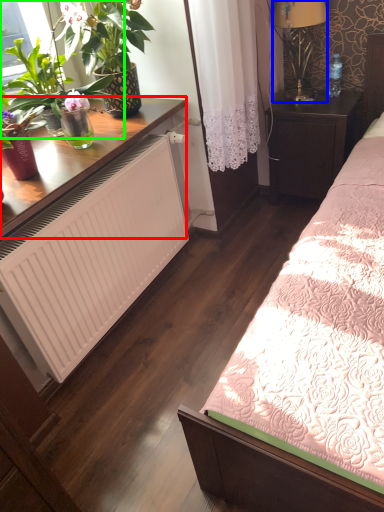
Question: Which object is the closest to the desk (highlighted by a red box)? Choose among these: lamp (highlighted by a blue box) or houseplant (highlighted by a green box).

Choices:
 (A) lamp
 (B) houseplant

Answer: (B)